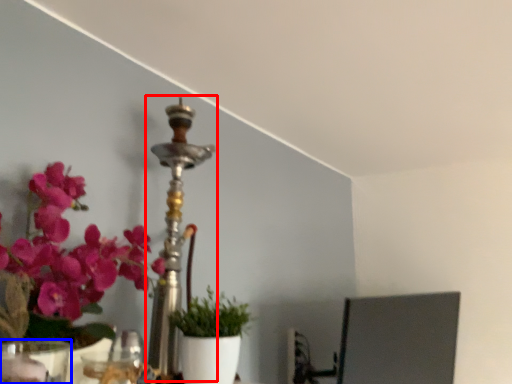
Question: Which of the following is the closest to the observer, candle holder (highlighted by a red box) or vase (highlighted by a blue box)?

Choices:
 (A) candle holder
 (B) vase

Answer: (B)